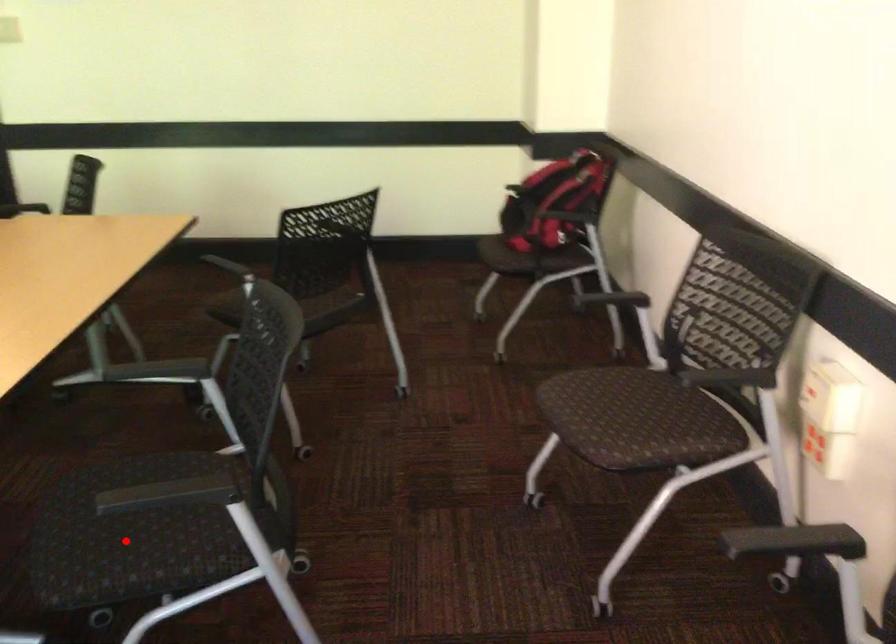
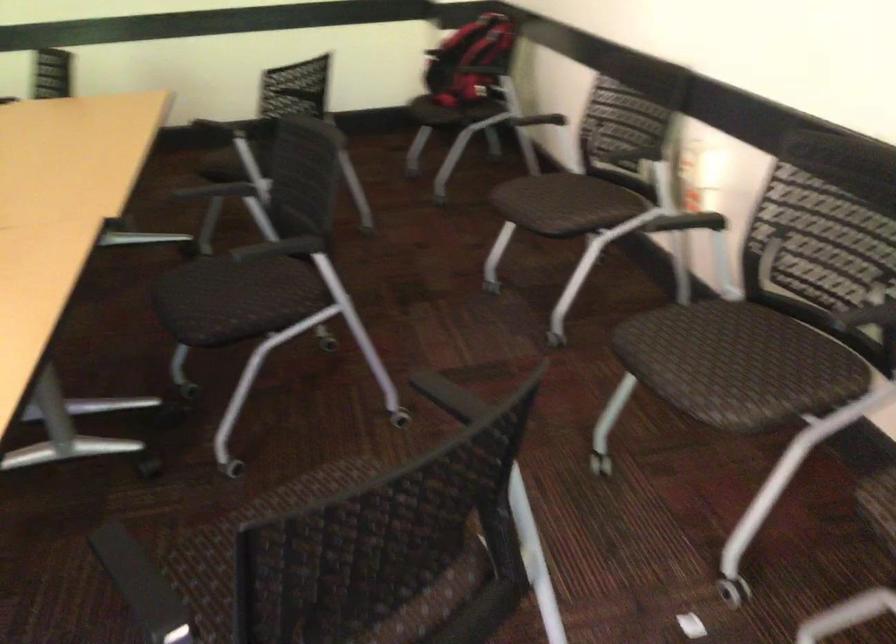
Question: A red point is marked in image1. In image2, is the corresponding 3D point closer to the camera or farther? Reply with the corresponding letter.

Choices:
 (A) The corresponding 3D point is closer.
 (B) The corresponding 3D point is farther.

Answer: (B)